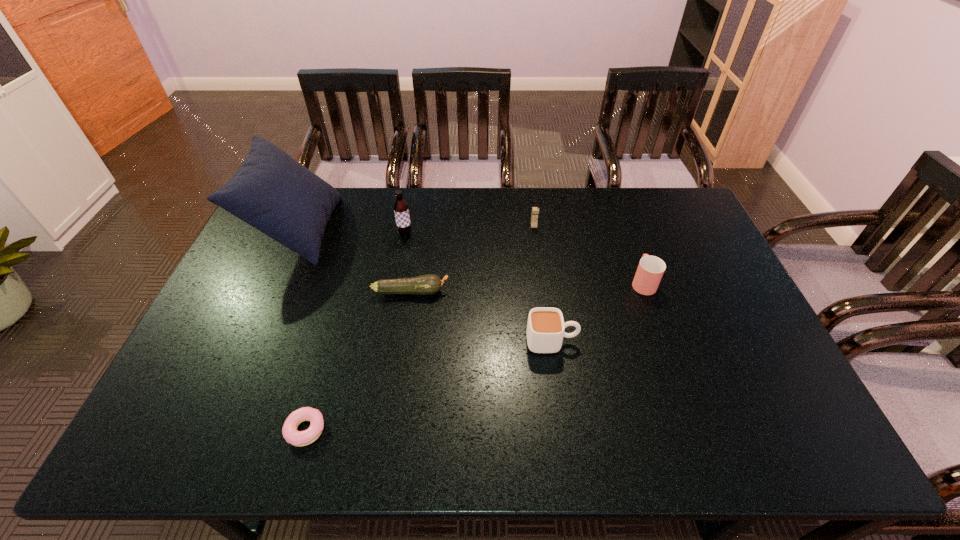
Image resolution: width=960 pixels, height=540 pixels. Find the location of `the second object from left to right`. the second object from left to right is located at coordinates click(x=289, y=430).

You are a GUI agent. You are given a task and a screenshot of the screen. Output one action in this format:
    pyautogui.click(x=<x>, y=<y>)
    Task: Click on the free location located on the facing side of the leftmost object
    This screenshot has width=960, height=540.
    Given the screenshot: What is the action you would take?
    pyautogui.click(x=373, y=230)

At what (x,y) coordinates should I click in order to perform the action: click on vacant space located 0.310m on the left of the root beer. Please return your answer as a coordinate pair (x, y). This screenshot has height=540, width=960. Looking at the image, I should click on pyautogui.click(x=307, y=235).

What are the coordinates of `vacant space located 0.170m on the front of the cellular telephone, where the keypad is located` in the screenshot? It's located at (539, 262).

You are a GUI agent. You are given a task and a screenshot of the screen. Output one action in this format:
    pyautogui.click(x=<x>, y=<y>)
    Task: Click on the free space located on the side of the right cup with the handle
    
    Given the screenshot: What is the action you would take?
    pyautogui.click(x=620, y=217)

The image size is (960, 540). Find the location of `free spot located 0.190m on the side of the right cup with the handle`. free spot located 0.190m on the side of the right cup with the handle is located at coordinates (625, 231).

Where is `vacant region located 0.290m on the side of the right cup with the handle`? The width and height of the screenshot is (960, 540). vacant region located 0.290m on the side of the right cup with the handle is located at coordinates (618, 213).

Where is `vacant area situated on the side with the handle of the left cup`? The image size is (960, 540). vacant area situated on the side with the handle of the left cup is located at coordinates (684, 341).

Identify the location of vacant area situated 0.380m at the blossom end of the zucchini. (575, 292).

The height and width of the screenshot is (540, 960). What are the coordinates of `free space located on the back of the nearest object` in the screenshot? It's located at (336, 326).